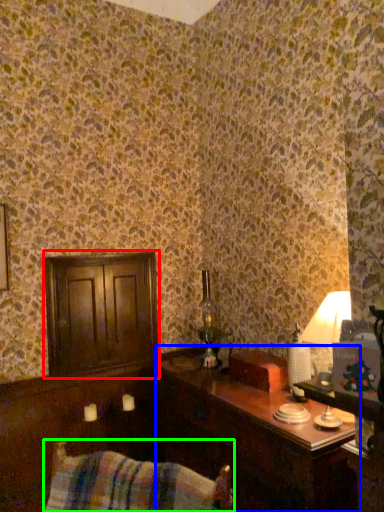
Question: Estimate the real-world distances between objects in this image. Which object is farther from dresser (highlighted by a red box), table (highlighted by a blue box) or swivel chair (highlighted by a green box)?

Choices:
 (A) table
 (B) swivel chair

Answer: (B)